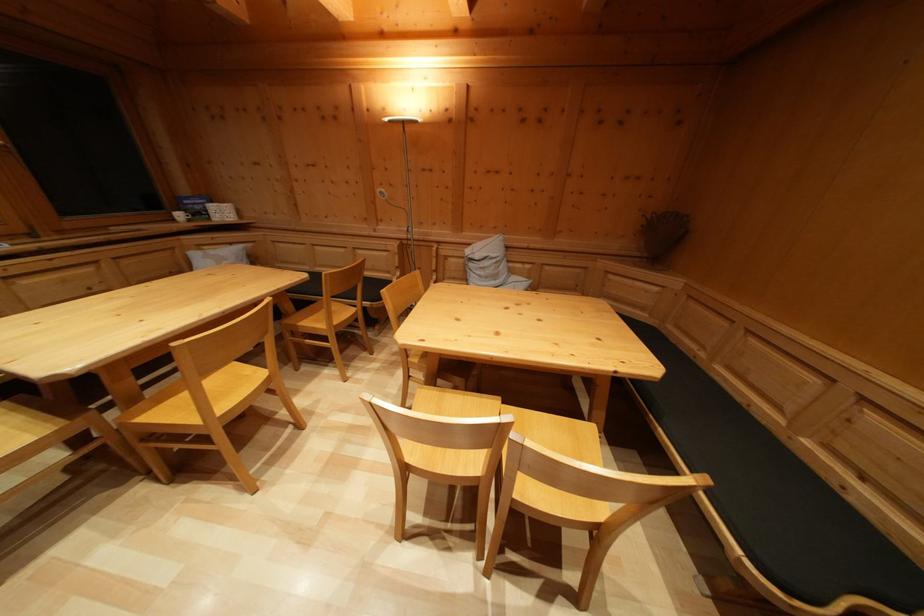
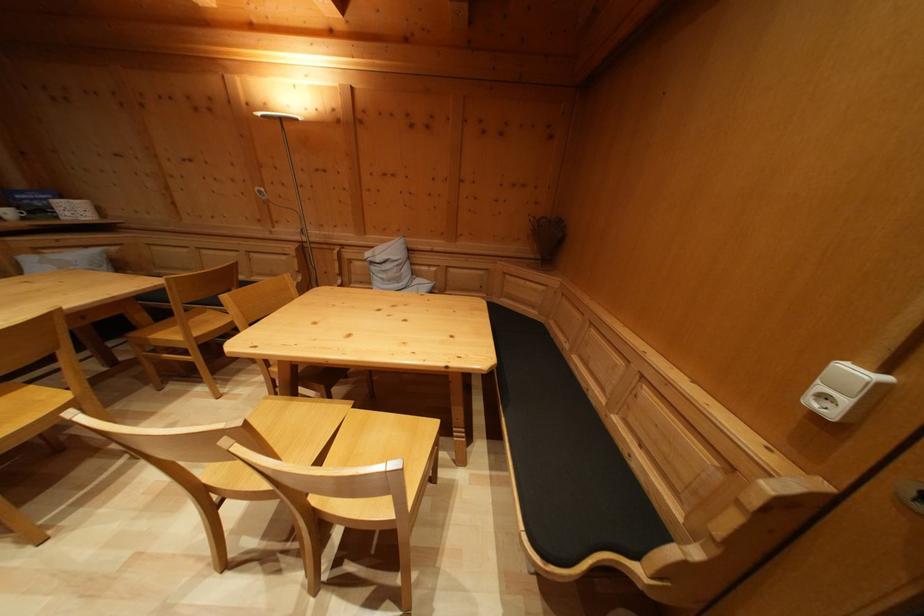
Find the pixel in the second image that matches (505,405) in the first image.

(359, 408)